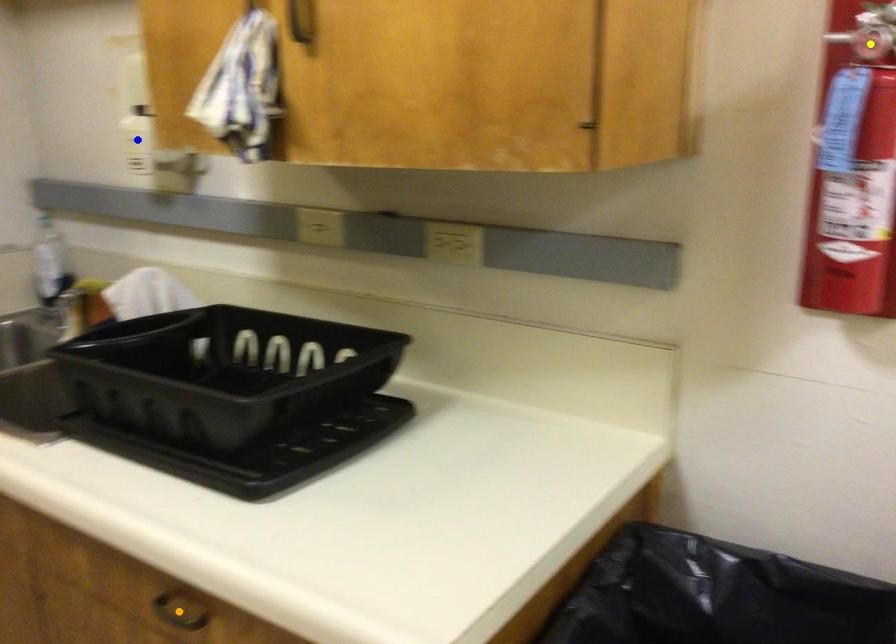
Order these from nearest to farthest:
1. yellow point
2. blue point
3. orange point

1. blue point
2. orange point
3. yellow point